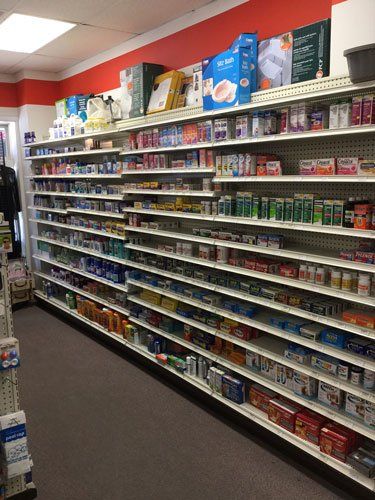
This screenshot has height=500, width=375. I want to click on hooks, so click(19, 421), click(13, 383), click(5, 305), click(6, 264).